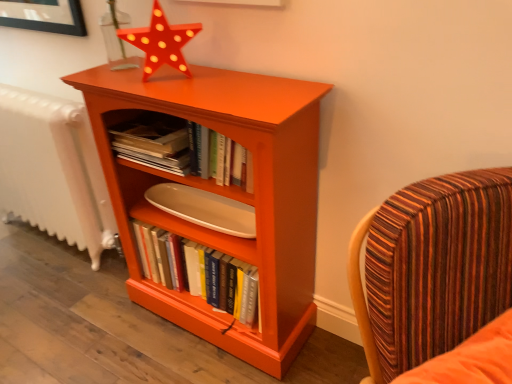
Find the location of `blank space to the left of orange matte wood bookcase at center`. blank space to the left of orange matte wood bookcase at center is located at coordinates (92, 328).